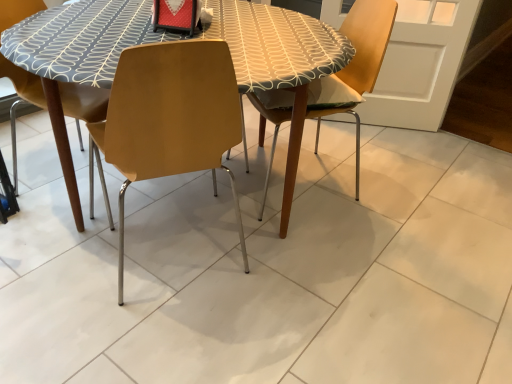
The image size is (512, 384). Identify the location of free space in front of wooden chair at center, placed as the 1th chair when sorted from right to left. (348, 249).